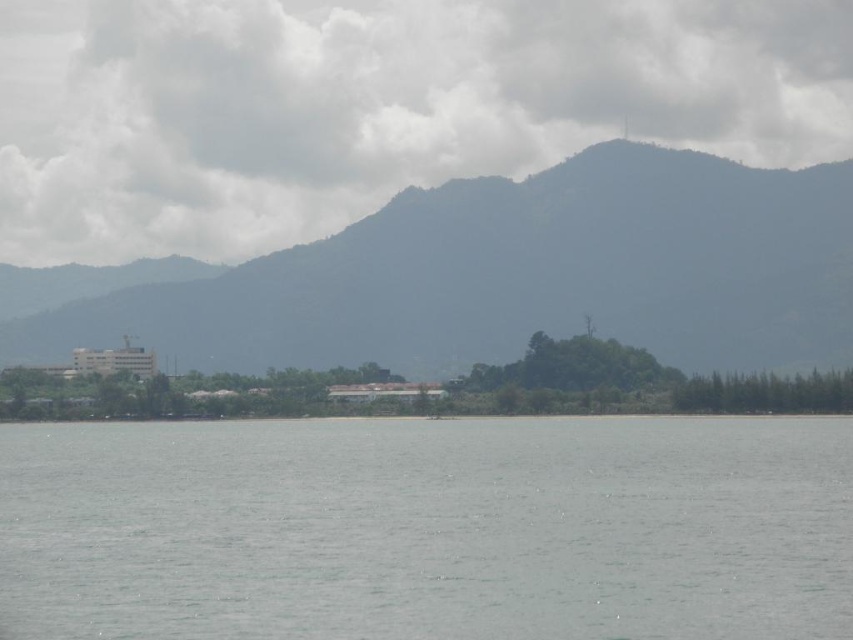
Who is positioned more to the left, white fluffy cloud at upper center or green textured mountain at center?

From the viewer's perspective, white fluffy cloud at upper center appears more on the left side.

Which is in front, point (802, 4) or point (845, 305)?

Point (845, 305) is in front.

The image size is (853, 640). In order to click on white fluffy cloud at upper center in this screenshot , I will do `click(373, 106)`.

Is gray water at center smaller than white fluffy cloud at upper center?

No, gray water at center is not smaller than white fluffy cloud at upper center.

Consider the image. Is gray water at center thinner than white fluffy cloud at upper center?

Correct, gray water at center's width is less than white fluffy cloud at upper center's.

Where is `gray water at center`? The height and width of the screenshot is (640, 853). gray water at center is located at coordinates (428, 529).

At what (x,y) coordinates should I click in order to perform the action: click on gray water at center. Please return your answer as a coordinate pair (x, y). Looking at the image, I should click on (428, 529).

This screenshot has width=853, height=640. I want to click on gray water at center, so click(x=428, y=529).

Is gray water at center closer to the viewer compared to green textured mountain at center?

Yes, gray water at center is in front of green textured mountain at center.

This screenshot has height=640, width=853. What do you see at coordinates (428, 529) in the screenshot?
I see `gray water at center` at bounding box center [428, 529].

You are a GUI agent. You are given a task and a screenshot of the screen. Output one action in this format:
    pyautogui.click(x=<x>, y=<y>)
    Task: Click on the gray water at center
    The height and width of the screenshot is (640, 853).
    Given the screenshot: What is the action you would take?
    pyautogui.click(x=428, y=529)